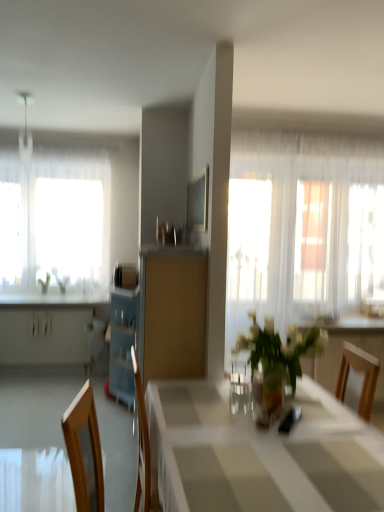
Question: From the image's perspective, is translucent glass vase at center on top of white glossy table at center?

Choices:
 (A) no
 (B) yes

Answer: (B)

Question: Can you confirm if translucent glass vase at center is positioned to the right of white glossy table at center?

Choices:
 (A) yes
 (B) no

Answer: (A)

Question: From the image's perspective, is translucent glass vase at center beneath white glossy table at center?

Choices:
 (A) yes
 (B) no

Answer: (B)

Question: From a real-world perspective, is translucent glass vase at center physically above white glossy table at center?

Choices:
 (A) no
 (B) yes

Answer: (B)

Question: Is translucent glass vase at center at the left side of white glossy table at center?

Choices:
 (A) no
 (B) yes

Answer: (A)

Question: Does translucent glass vase at center have a smaller size compared to white glossy table at center?

Choices:
 (A) yes
 (B) no

Answer: (A)

Question: Is translucent glass window at left oriented towards green leafy plant at left?

Choices:
 (A) no
 (B) yes

Answer: (B)

Question: Does translucent glass window at left appear on the right side of green leafy plant at left?

Choices:
 (A) yes
 (B) no

Answer: (B)

Question: Is translucent glass window at left shorter than green leafy plant at left?

Choices:
 (A) no
 (B) yes

Answer: (A)

Question: Is green leafy plant at left surrounded by translucent glass window at left?

Choices:
 (A) no
 (B) yes

Answer: (A)

Question: Does translucent glass window at left lie in front of green leafy plant at left?

Choices:
 (A) yes
 (B) no

Answer: (A)

Question: Is translucent glass window at left positioned with its back to green leafy plant at left?

Choices:
 (A) yes
 (B) no

Answer: (A)

Question: From the image's perspective, is white glossy table at center above white glossy countertop at left?

Choices:
 (A) yes
 (B) no

Answer: (B)